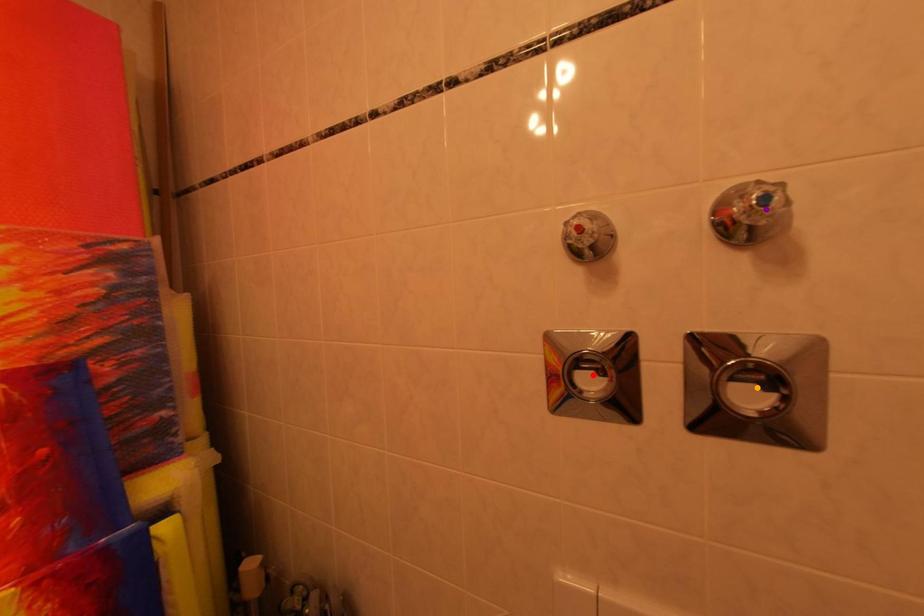
Order these from nearest to farthest:
1. purple point
2. orange point
3. red point

purple point < orange point < red point